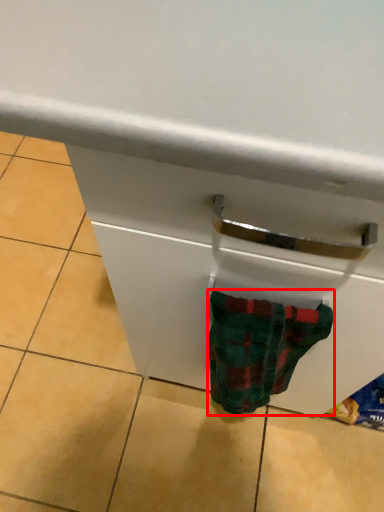
Question: From the image's perspective, what is the correct spatial relationship of sock (annotated by the red box) in relation to drawer?

Choices:
 (A) below
 (B) above

Answer: (A)